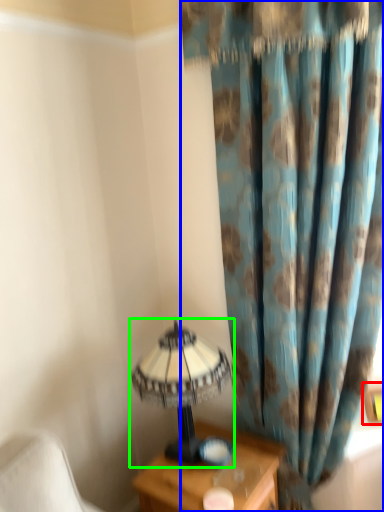
Question: Which object is positioned farthest from picture frame (highlighted by a red box)? Select from curtain (highlighted by a blue box) and lamp (highlighted by a green box).

Choices:
 (A) curtain
 (B) lamp

Answer: (A)